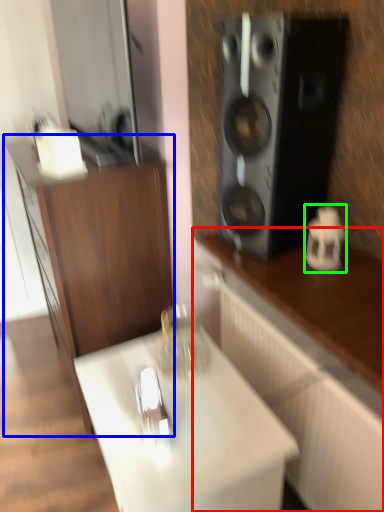
Question: Which object is positioned closest to cabinetry (highlighted by a red box)? Select from cabinetry (highlighted by a blue box) and appliance (highlighted by a green box).

Choices:
 (A) cabinetry
 (B) appliance

Answer: (B)